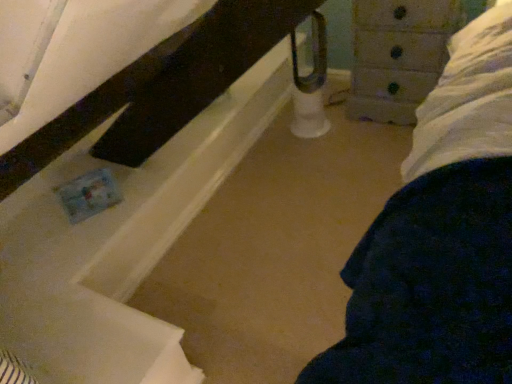
This screenshot has height=384, width=512. Identify the location of wooden chest of drawers at upper right. (398, 55).

Describe the element at coordinates (398, 55) in the screenshot. I see `wooden chest of drawers at upper right` at that location.

Measure the distance between point (443, 31) and camera.

Point (443, 31) is 1.75 meters away from camera.

You are a GUI agent. You are given a task and a screenshot of the screen. Output one action in this format:
    pyautogui.click(x=<x>, y=<y>)
    Task: Click on the wooden chest of drawers at upper right
    This screenshot has width=512, height=384.
    Given the screenshot: What is the action you would take?
    pyautogui.click(x=398, y=55)